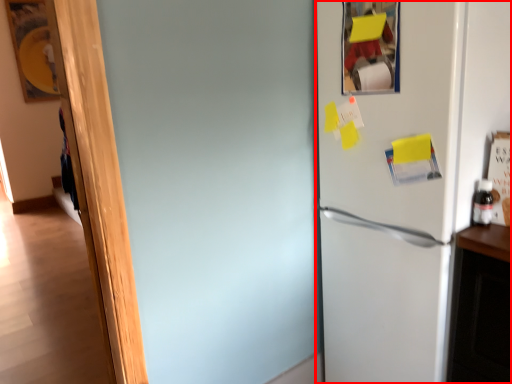
Question: From the image's perspective, where is refrigerator (annotated by the red box) located in relation to bottle in the image?

Choices:
 (A) above
 (B) below

Answer: (B)